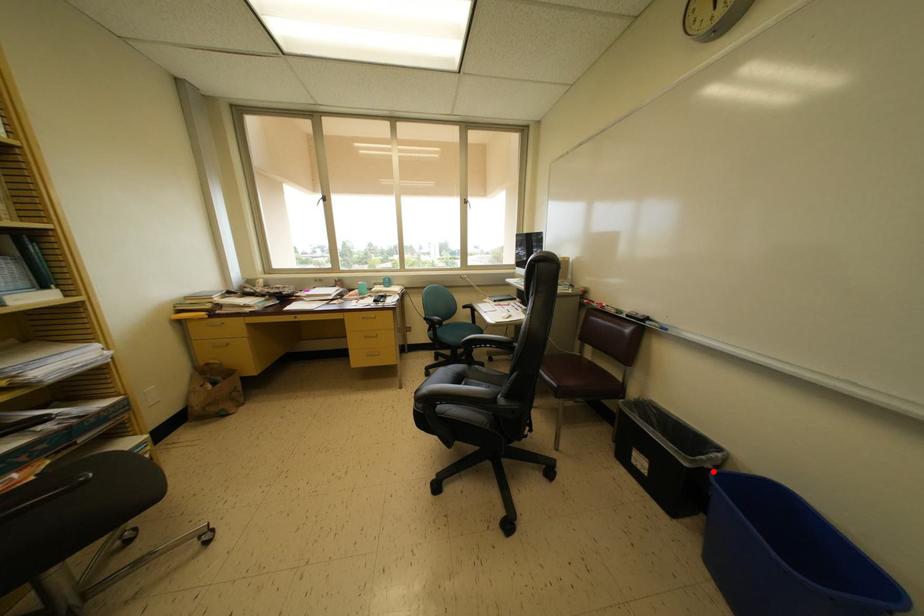
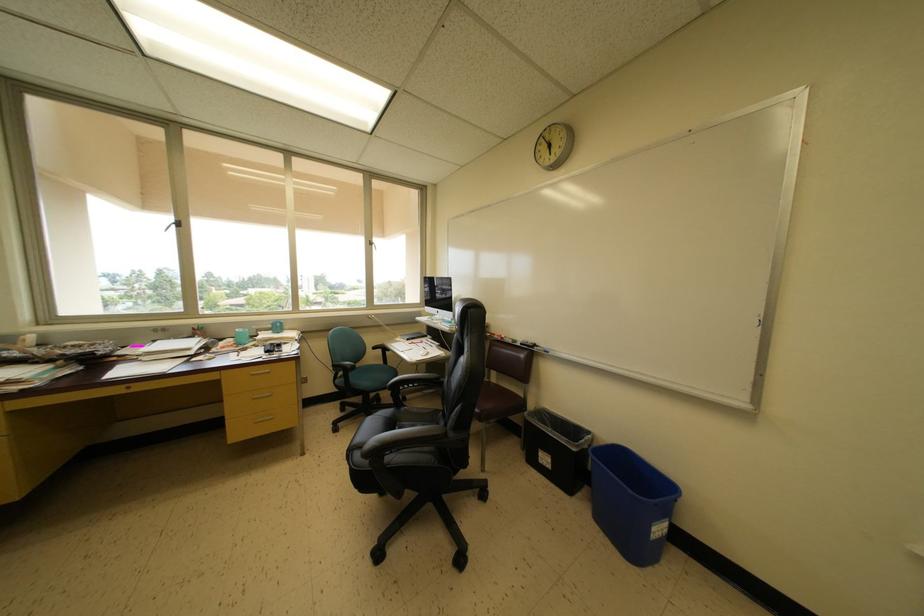
The point at the highlighted location is marked in the first image. Where is the corresponding point in the second image?

(590, 451)